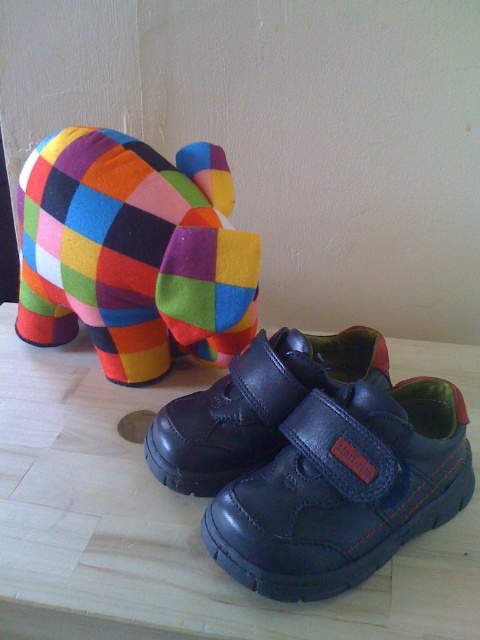
Is multicolored felt elephant at upper left below shiny black leather shoe at center?

Incorrect, multicolored felt elephant at upper left is not positioned below shiny black leather shoe at center.

Who is lower down, multicolored felt elephant at upper left or shiny black leather shoe at center?

shiny black leather shoe at center is lower down.

Who is more forward, (226, 273) or (445, 394)?

Point (445, 394) is more forward.

You are a GUI agent. You are given a task and a screenshot of the screen. Output one action in this format:
    pyautogui.click(x=<x>, y=<y>)
    Task: Click on the multicolored felt elephant at upper left
    Image resolution: width=480 pixels, height=640 pixels.
    Given the screenshot: What is the action you would take?
    pyautogui.click(x=133, y=252)

Is multicolored felt elephant at upper left wider than black leather shoe at lower center?

Correct, the width of multicolored felt elephant at upper left exceeds that of black leather shoe at lower center.

Is point (108, 152) farther from camera compared to point (280, 349)?

That is True.

This screenshot has height=640, width=480. Identify the location of multicolored felt elephant at upper left. (133, 252).

From the picture: Does shiny black leather shoe at center have a greater height compared to black leather shoe at lower center?

Correct, shiny black leather shoe at center is much taller as black leather shoe at lower center.

Is shiny black leather shoe at center in front of black leather shoe at lower center?

Yes, it is.

Is point (262, 520) closer to viewer compared to point (164, 451)?

That is True.

Find the location of a particular element. The width and height of the screenshot is (480, 640). shiny black leather shoe at center is located at coordinates (345, 490).